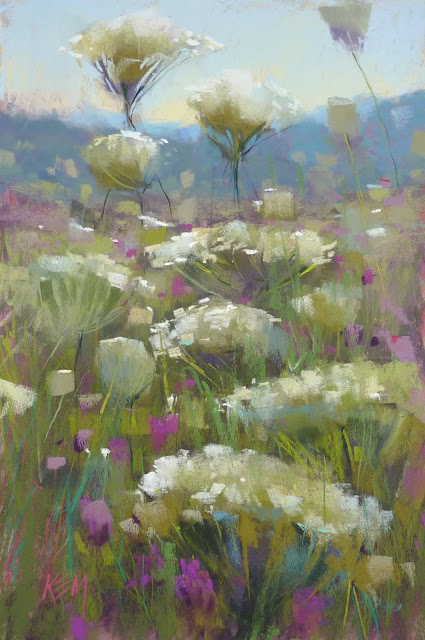
In order to click on painting in this screenshot , I will do (x=213, y=180).